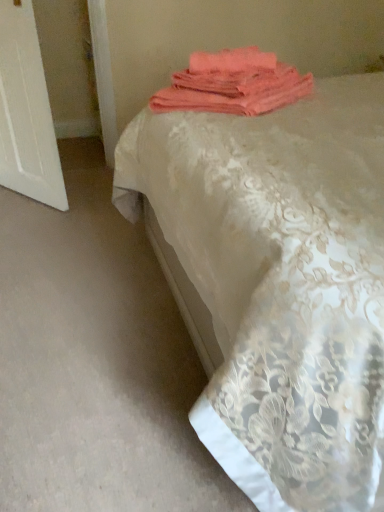
Question: Is the position of silky lace bedspread at center less distant than that of white wood door at left?

Choices:
 (A) no
 (B) yes

Answer: (B)

Question: Is silky lace bedspread at center next to white wood door at left and touching it?

Choices:
 (A) no
 (B) yes

Answer: (A)

Question: Is silky lace bedspread at center not inside white wood door at left?

Choices:
 (A) no
 (B) yes

Answer: (B)

Question: From a real-world perspective, is silky lace bedspread at center positioned under white wood door at left based on gravity?

Choices:
 (A) no
 (B) yes

Answer: (A)

Question: From the image's perspective, is silky lace bedspread at center under white wood door at left?

Choices:
 (A) no
 (B) yes

Answer: (B)

Question: Considering the relative positions of silky lace bedspread at center and white wood door at left in the image provided, is silky lace bedspread at center to the right of white wood door at left from the viewer's perspective?

Choices:
 (A) no
 (B) yes

Answer: (B)

Question: Are white wood door at left and silky lace bedspread at center making contact?

Choices:
 (A) no
 (B) yes

Answer: (A)

Question: From the image's perspective, is white wood door at left on silky lace bedspread at center?

Choices:
 (A) yes
 (B) no

Answer: (A)

Question: Is white wood door at left at the right side of silky lace bedspread at center?

Choices:
 (A) yes
 (B) no

Answer: (B)

Question: Does white wood door at left appear on the left side of silky lace bedspread at center?

Choices:
 (A) yes
 (B) no

Answer: (A)

Question: From a real-world perspective, is white wood door at left positioned under silky lace bedspread at center based on gravity?

Choices:
 (A) yes
 (B) no

Answer: (A)

Question: Can you confirm if white wood door at left is shorter than silky lace bedspread at center?

Choices:
 (A) no
 (B) yes

Answer: (B)

Question: Is coral fabric towel at upper center positioned before silky lace bedspread at center?

Choices:
 (A) no
 (B) yes

Answer: (A)